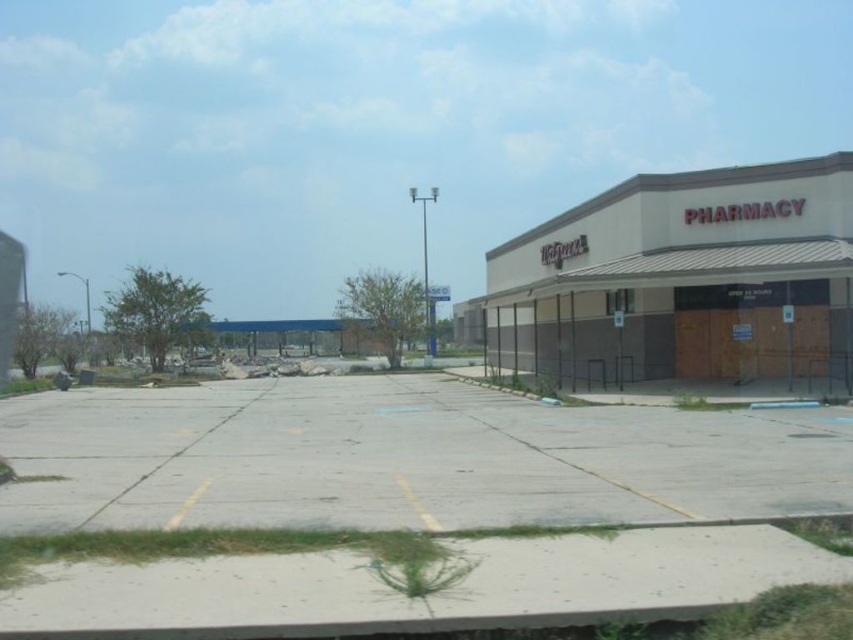
You are standing at the edge of the gray concrete parking lot at center and looking towards the brown matte building at right. Which direction should you walk to reach the building?

You should walk upwards towards the brown matte building at right since the gray concrete parking lot at center is below it.

You are a delivery person trying to park your van in the gray concrete parking lot at center. The van is 2 meters wide. The parking spaces are marked by faded yellow lines. Can you park your van in the parking lot without hitting the brown matte building at right?

The gray concrete parking lot at center is in front of the brown matte building at right, so there should be enough space between them. The van can park in the parking lot without hitting the building.

You are a delivery person standing at the gray concrete parking lot at center. You need to deliver a package to the brown matte building at right. The delivery robot you are using has a maximum range of 12 meters. Can the robot reach the building from your current position?

The distance between the gray concrete parking lot at center and the brown matte building at right is 12.49 meters, which exceeds the robot maximum range of 12 meters. Therefore, the robot cannot reach the building from the current position.